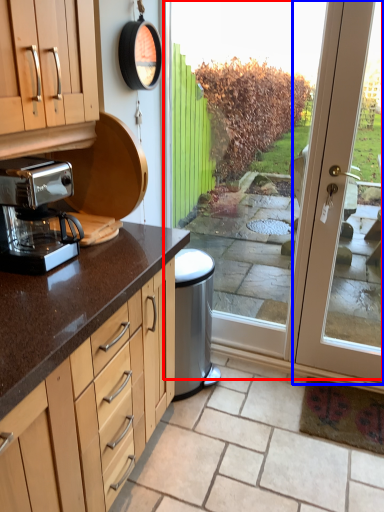
Question: Which point is closer to the camera, screen door (highlighted by a red box) or door (highlighted by a blue box)?

Choices:
 (A) screen door
 (B) door

Answer: (B)